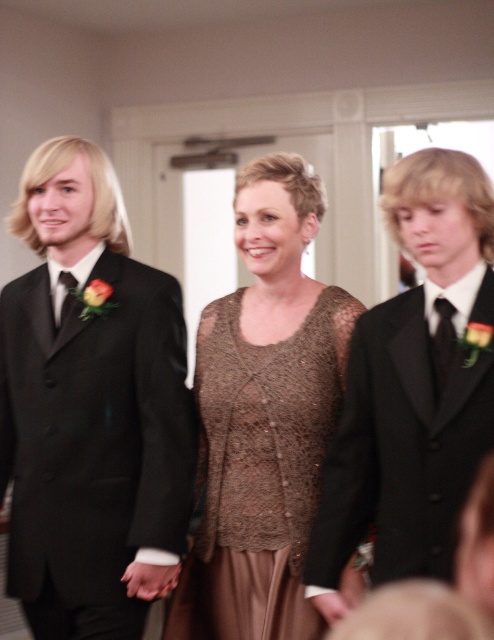
You are a photographer at this event and need to adjust the camera height to focus on the matte black suit at left and the brown knitted sweater at center. Which person should you lower the camera to capture better?

The matte black suit at left is much taller than the brown knitted sweater at center, so you should lower the camera to better capture the taller person in the matte black suit at left.

You are a photographer at a formal event and need to capture a closeup shot of both the black satin tie at right and the matte black tie at left without moving the subjects. Can you fit both ties in the frame if your camera has a maximum field of view of 40 inches?

The distance between the black satin tie at right and the matte black tie at left is 39.24 inches, which is less than the camera field of view of 40 inches. Therefore, both ties can be captured in a single frame without moving the subjects.

Consider the image. You are a tailor who needs to determine which tie requires more fabric to create. Based on the image, which tie between the black satin tie at right and the matte black tie at left would need more material?

The black satin tie at right requires more fabric because it is wider than the matte black tie at left.